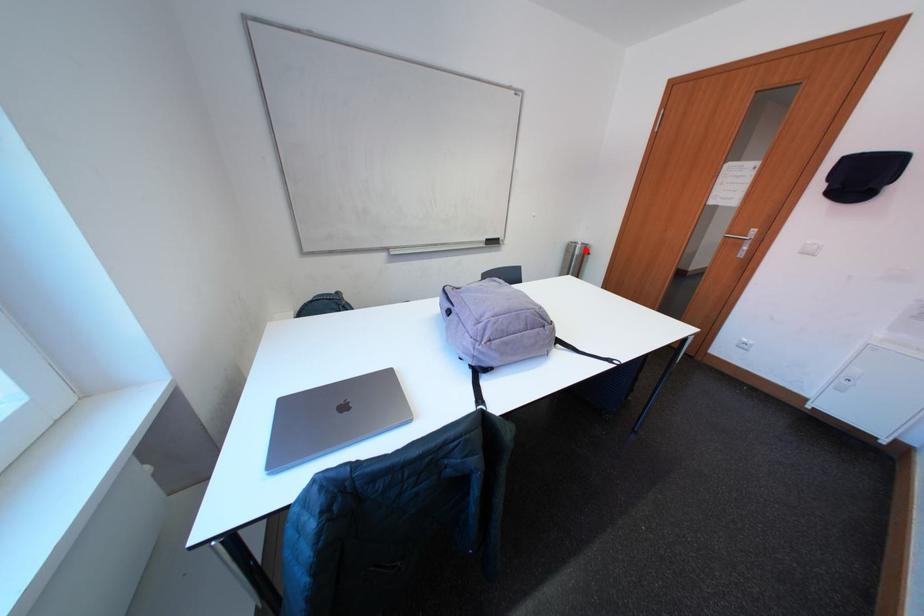
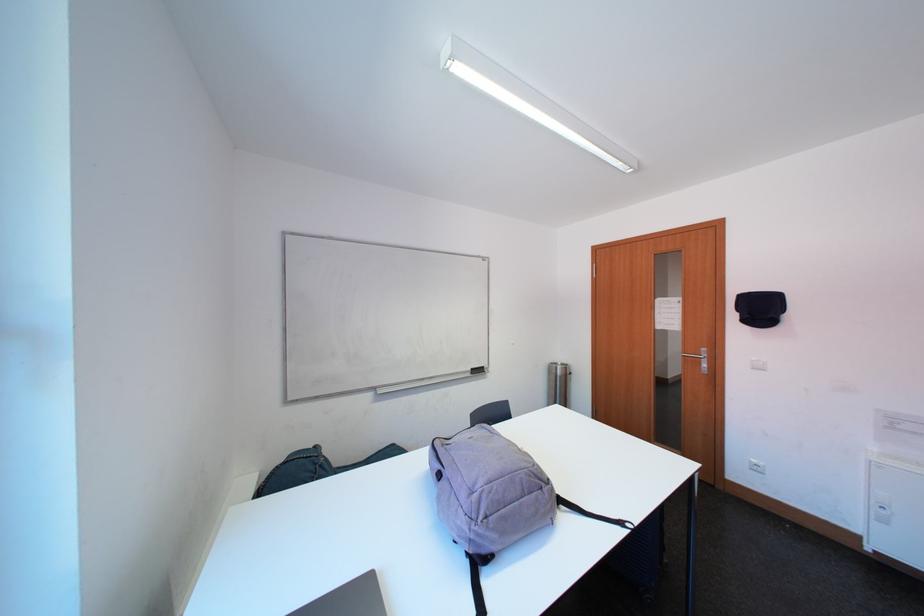
In the second image, find the point that corresponds to the highlighted location in the first image.

(565, 371)